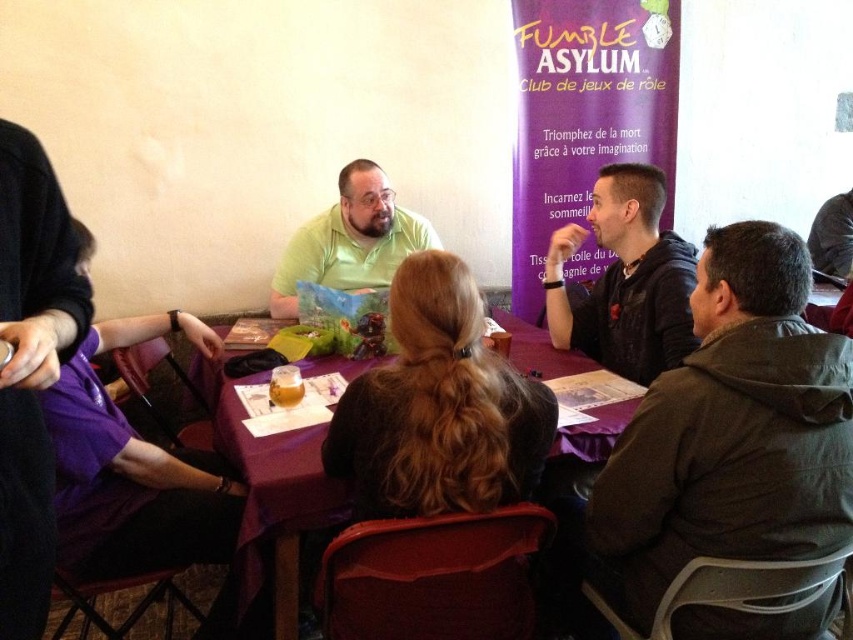
Based on the photo, is dark gray hoodie at lower right bigger than black leather jacket at center?

Correct, dark gray hoodie at lower right is larger in size than black leather jacket at center.

Who is more forward, (769, 534) or (593, 358)?

Point (769, 534) is more forward.

Who is more forward, (769,488) or (563,237)?

Point (769,488) is in front.

Where is `dark gray hoodie at lower right`? dark gray hoodie at lower right is located at coordinates (730, 433).

Between point (250, 476) and point (349, 237), which one is positioned behind?

The point (349, 237) is more distant.

Who is more distant from viewer, [270,499] or [352,196]?

Positioned behind is point [352,196].

Locate an element on the screen. This screenshot has height=640, width=853. purple fabric table at center is located at coordinates (270, 509).

Is dark gray hoodie at lower right taller than green matte shirt at center?

Correct, dark gray hoodie at lower right is much taller as green matte shirt at center.

Is dark gray hoodie at lower right to the left of green matte shirt at center from the viewer's perspective?

Incorrect, dark gray hoodie at lower right is not on the left side of green matte shirt at center.

What are the coordinates of `dark gray hoodie at lower right` in the screenshot? It's located at (730, 433).

The width and height of the screenshot is (853, 640). I want to click on dark gray hoodie at lower right, so click(730, 433).